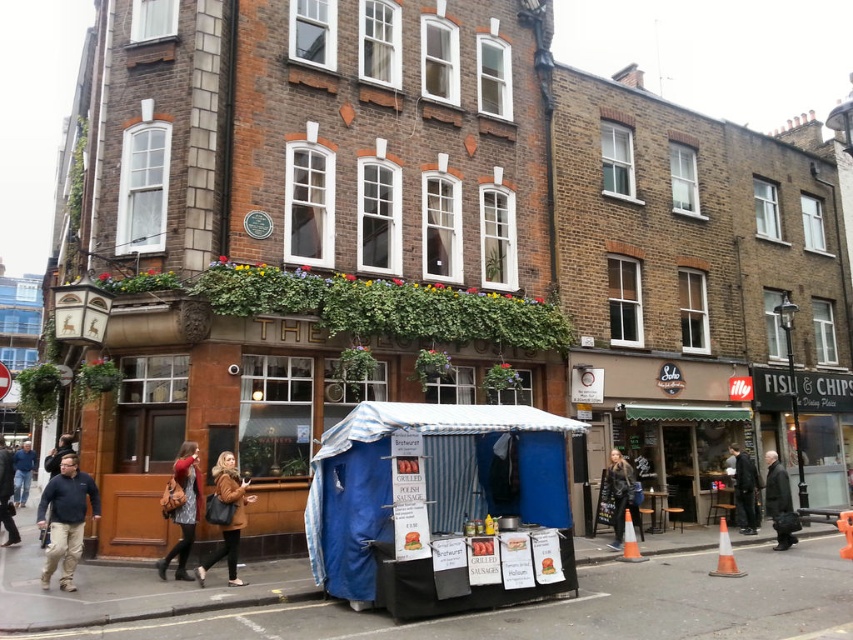
Question: Among these points, which one is nearest to the camera?

Choices:
 (A) (614, 513)
 (B) (167, 504)
 (C) (18, 538)

Answer: (B)

Question: Does dark blue fleece jacket at lower left have a smaller size compared to dark wool coat at lower right?

Choices:
 (A) yes
 (B) no

Answer: (A)

Question: Does dark brown leather jacket at lower left come in front of blue jeans at lower left?

Choices:
 (A) no
 (B) yes

Answer: (B)

Question: Does dark blue fleece jacket at lower left appear under dark brown leather jacket at lower left?

Choices:
 (A) yes
 (B) no

Answer: (B)

Question: Estimate the real-world distances between objects in this image. Which object is farther from the dark wool coat at lower right?

Choices:
 (A) dark blue fleece jacket at lower left
 (B) matte brown leather bag at lower left

Answer: (A)

Question: Which of the following is the farthest from the observer?

Choices:
 (A) blue jeans at lower left
 (B) matte brown leather bag at lower left
 (C) dark wool coat at lower right

Answer: (A)